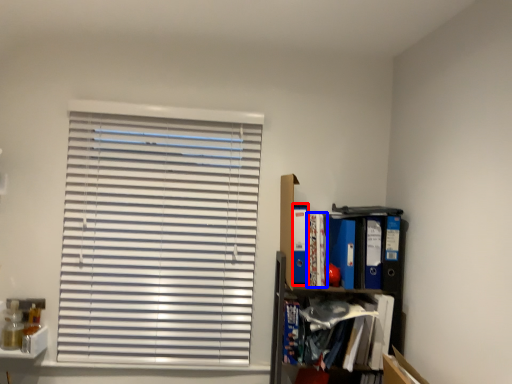
Question: Which object appears farthest to the camera in this image, paperback book (highlighted by a red box) or book (highlighted by a blue box)?

Choices:
 (A) paperback book
 (B) book

Answer: (A)